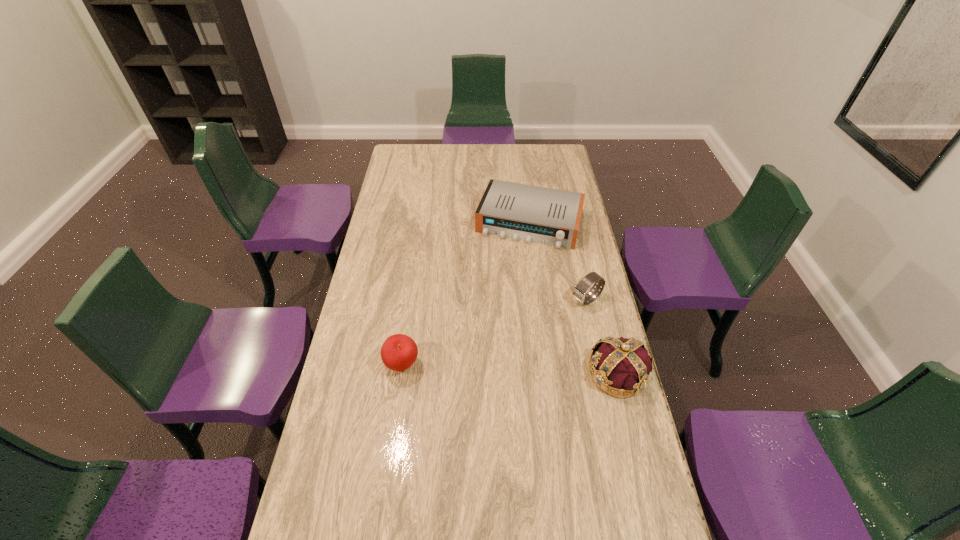
The height and width of the screenshot is (540, 960). Identify the location of vacant space at the far left corner of the desktop. (424, 166).

The image size is (960, 540). In the image, there is a desktop. Identify the location of vacant area at the near left corner. (357, 522).

Locate an element on the screen. Image resolution: width=960 pixels, height=540 pixels. free space between the leftmost object and the crown is located at coordinates [x=510, y=369].

In order to click on blank region between the crown and the shortest object in this screenshot , I will do `click(573, 298)`.

Locate an element on the screen. free space between the leftmost object and the crown is located at coordinates (510, 369).

Find the location of a particular element. vacant space in between the leftmost object and the tallest object is located at coordinates (510, 369).

What are the coordinates of `free spot between the crown and the apple` in the screenshot? It's located at (510, 369).

The width and height of the screenshot is (960, 540). I want to click on free space between the crown and the apple, so click(x=510, y=369).

I want to click on empty space that is in between the watch and the apple, so pyautogui.click(x=494, y=332).

Identify the location of vacant space that's between the radio receiver and the apple. (466, 294).